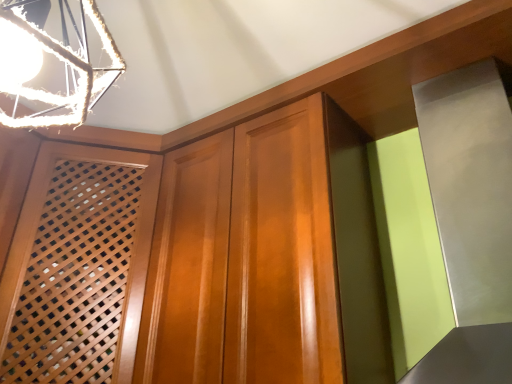
At what (x,y) coordinates should I click in order to perform the action: click on metallic rope at upper left. Please return your answer as a coordinate pair (x, y). This screenshot has width=512, height=384. Looking at the image, I should click on (70, 67).

This screenshot has height=384, width=512. Describe the element at coordinates (70, 67) in the screenshot. I see `metallic rope at upper left` at that location.

Looking at this image, measure the distance between wooden lattice screen at left and camera.

wooden lattice screen at left is 1.13 meters away from camera.

What do you see at coordinates (78, 266) in the screenshot? The width and height of the screenshot is (512, 384). I see `wooden lattice screen at left` at bounding box center [78, 266].

Identify the location of wooden lattice screen at left. (78, 266).

I want to click on metallic rope at upper left, so pyautogui.click(x=70, y=67).

Which object is positioned more to the left, metallic rope at upper left or wooden lattice screen at left?

wooden lattice screen at left is more to the left.

Is metallic rope at upper left further to the viewer compared to wooden lattice screen at left?

No, metallic rope at upper left is in front of wooden lattice screen at left.

Is point (11, 118) closer or farther from the camera than point (45, 204)?

Point (11, 118) is closer to the camera than point (45, 204).

From the image's perspective, which is below, metallic rope at upper left or wooden lattice screen at left?

From the image's view, wooden lattice screen at left is below.

From a real-world perspective, between metallic rope at upper left and wooden lattice screen at left, who is vertically higher?

metallic rope at upper left is physically above.

Does metallic rope at upper left have a greater width compared to wooden lattice screen at left?

No.

Which of these two, metallic rope at upper left or wooden lattice screen at left, stands taller?

Standing taller between the two is wooden lattice screen at left.

Considering the sizes of objects metallic rope at upper left and wooden lattice screen at left in the image provided, who is bigger, metallic rope at upper left or wooden lattice screen at left?

wooden lattice screen at left is bigger.

Consider the image. Is metallic rope at upper left positioned beyond the bounds of wooden lattice screen at left?

Yes, metallic rope at upper left is not within wooden lattice screen at left.

Is metallic rope at upper left directly adjacent to wooden lattice screen at left?

No.

Is metallic rope at upper left facing away from wooden lattice screen at left?

No, wooden lattice screen at left is not at the back of metallic rope at upper left.

Locate an element on the screen. The image size is (512, 384). screen door located below the metallic rope at upper left (from the image's perspective) is located at coordinates (78, 266).

Based on their positions, is wooden lattice screen at left located to the left or right of metallic rope at upper left?

In the image, wooden lattice screen at left appears on the left side of metallic rope at upper left.

Considering their positions, is wooden lattice screen at left located in front of or behind metallic rope at upper left?

In the image, wooden lattice screen at left appears behind metallic rope at upper left.

Is point (36, 171) positioned before point (40, 31)?

That is False.

From the image's perspective, which is above, wooden lattice screen at left or metallic rope at upper left?

metallic rope at upper left is shown above in the image.

From a real-world perspective, is wooden lattice screen at left above or below metallic rope at upper left?

In terms of real-world spatial position, wooden lattice screen at left is below metallic rope at upper left.

Between wooden lattice screen at left and metallic rope at upper left, which one has larger width?

wooden lattice screen at left.

From their relative heights in the image, would you say wooden lattice screen at left is taller or shorter than metallic rope at upper left?

Considering their sizes, wooden lattice screen at left has more height than metallic rope at upper left.

Considering the sizes of objects wooden lattice screen at left and metallic rope at upper left in the image provided, who is bigger, wooden lattice screen at left or metallic rope at upper left?

Bigger between the two is wooden lattice screen at left.

Is metallic rope at upper left inside wooden lattice screen at left?

Actually, metallic rope at upper left is outside wooden lattice screen at left.

Is wooden lattice screen at left next to metallic rope at upper left and touching it?

No, wooden lattice screen at left is not with metallic rope at upper left.

Could you tell me if wooden lattice screen at left is facing metallic rope at upper left?

Yes, wooden lattice screen at left is oriented towards metallic rope at upper left.

I want to click on lamp that is above the wooden lattice screen at left (from the image's perspective), so (x=70, y=67).

You are a GUI agent. You are given a task and a screenshot of the screen. Output one action in this format:
    pyautogui.click(x=<x>, y=<y>)
    Task: Click on the screen door on the left of the metallic rope at upper left
    Image resolution: width=512 pixels, height=384 pixels.
    Given the screenshot: What is the action you would take?
    pyautogui.click(x=78, y=266)

Where is `screen door behind the metallic rope at upper left`? screen door behind the metallic rope at upper left is located at coordinates (78, 266).